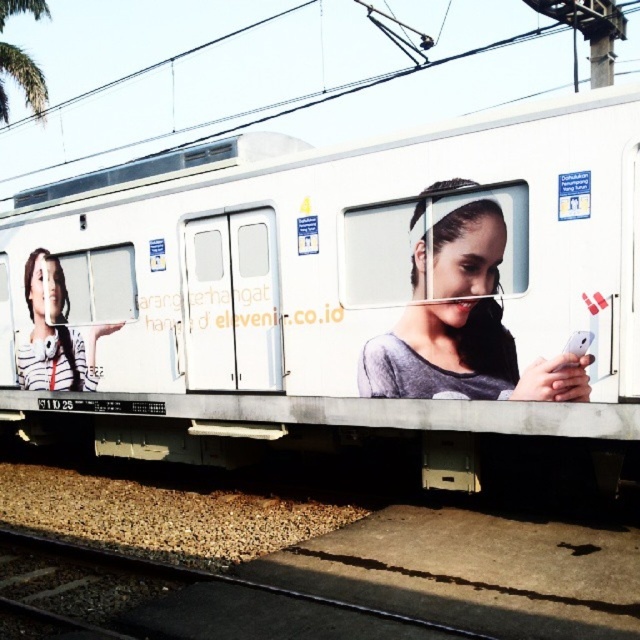
You are a photographer taking a picture of the white matte train at center and the matte gray phone at center. Which object will appear narrower in the photo?

The white matte train at center is thinner than the matte gray phone at center, so it will appear narrower in the photo.

You are a photographer standing on a platform next to the tracks. You want to take a photo of the white matte train at center and the striped fabric shirt at left so that both appear in the frame. Considering their sizes, which object should you move closer to ensure both fit in the photo?

The white matte train at center is thinner than the striped fabric shirt at left, so you should move closer to the striped fabric shirt at left to ensure both objects fit in the photo.

You are standing at the point marked with coordinates (x=337, y=294) on the train car. Which object is exactly at your current position?

The white matte train at center is exactly at the point marked with coordinates (x=337, y=294).